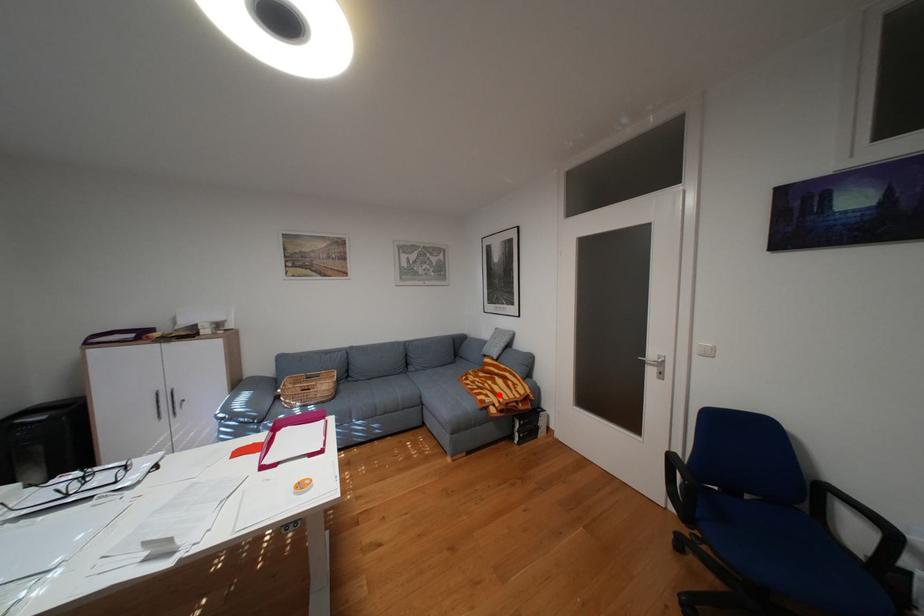
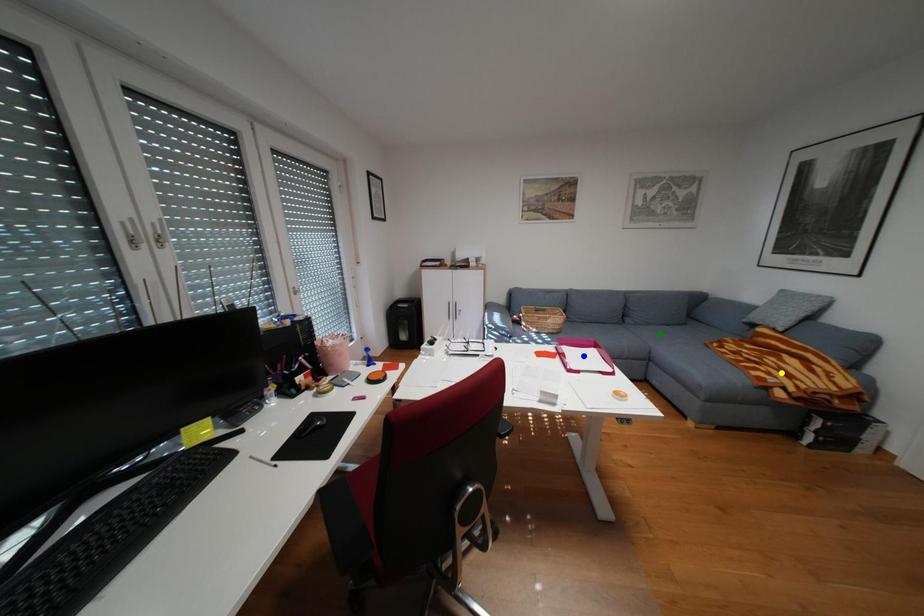
Question: I am providing you with two images of the same scene from different viewpoints. A red point is marked on the first image. You are given multiple points on the second image. Which mark in image 2 goes with the point in image 1?

Choices:
 (A) blue point
 (B) yellow point
 (C) green point

Answer: (B)